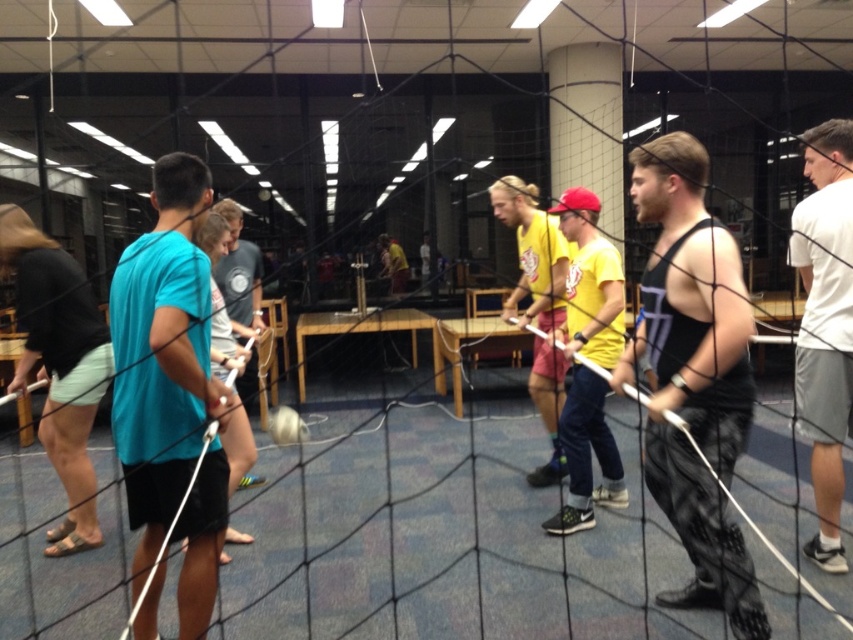
Based on the photo, who is more distant from viewer, (668, 500) or (396, 257)?

Positioned behind is point (396, 257).

Can you confirm if black tank top at center is positioned below yellow t-shirt at center?

Correct, black tank top at center is located below yellow t-shirt at center.

The image size is (853, 640). In order to click on black tank top at center in this screenshot , I will do `click(694, 376)`.

In order to click on black tank top at center in this screenshot , I will do `click(694, 376)`.

The image size is (853, 640). What do you see at coordinates (825, 324) in the screenshot?
I see `white cotton t-shirt at right` at bounding box center [825, 324].

Between white cotton t-shirt at right and yellow t-shirt at center, which one is positioned lower?

white cotton t-shirt at right is below.

Identify the location of white cotton t-shirt at right. (825, 324).

Does teal matte t-shirt at left appear on the right side of light blue fabric shirt at center?

Yes, teal matte t-shirt at left is to the right of light blue fabric shirt at center.

Does teal matte t-shirt at left appear under light blue fabric shirt at center?

Indeed, teal matte t-shirt at left is positioned under light blue fabric shirt at center.

Find the location of a particular element. The width and height of the screenshot is (853, 640). teal matte t-shirt at left is located at coordinates (161, 355).